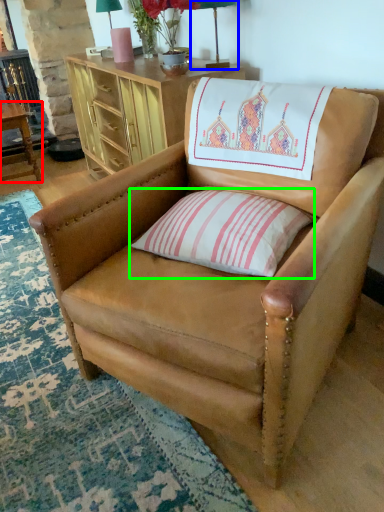
Question: Which is nearer to the table (highlighted by a red box)? table lamp (highlighted by a blue box) or pillow (highlighted by a green box).

Choices:
 (A) table lamp
 (B) pillow

Answer: (A)